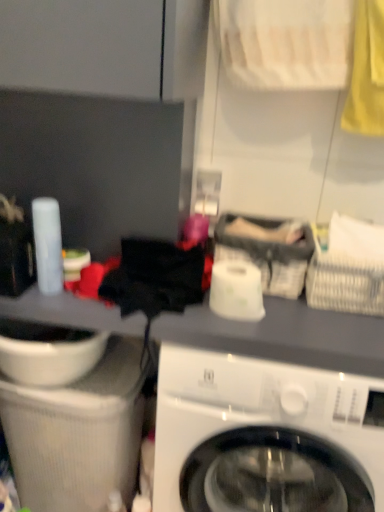
Describe the element at coordinates (268, 250) in the screenshot. I see `gray fabric basket at center, which ranks as the 1th basket in left-to-right order` at that location.

I want to click on white woven basket at upper right, the 2th basket from the left, so click(x=344, y=284).

Image resolution: width=384 pixels, height=512 pixels. What do you see at coordinates (344, 284) in the screenshot? I see `white woven basket at upper right, the 2th basket from the left` at bounding box center [344, 284].

I want to click on gray fabric basket at center, the second basket when ordered from right to left, so click(x=268, y=250).

Does point (375, 267) appear closer or farther from the camera than point (282, 239)?

Point (375, 267) is positioned closer to the camera compared to point (282, 239).

Is white woven basket at upper right, which is the first basket in right-to-left order, positioned far away from gray fabric basket at center, the second basket when ordered from right to left?

Actually, white woven basket at upper right, which is the first basket in right-to-left order, and gray fabric basket at center, the second basket when ordered from right to left, are a little close together.

Can you tell me how much white woven basket at upper right, which is the first basket in right-to-left order, and gray fabric basket at center, which ranks as the 1th basket in left-to-right order, differ in facing direction?

There is a 3.66-degree angle between the facing directions of white woven basket at upper right, which is the first basket in right-to-left order, and gray fabric basket at center, which ranks as the 1th basket in left-to-right order.

From a real-world perspective, does white woven basket at upper right, the 2th basket from the left, sit lower than gray fabric basket at center, which ranks as the 1th basket in left-to-right order?

Incorrect, from a real-world perspective, white woven basket at upper right, the 2th basket from the left, is higher than gray fabric basket at center, which ranks as the 1th basket in left-to-right order.

From a real-world perspective, is gray fabric basket at center, which ranks as the 1th basket in left-to-right order, physically above white glossy toilet paper at center?

Yes, from a real-world perspective, gray fabric basket at center, which ranks as the 1th basket in left-to-right order, is on top of white glossy toilet paper at center.

Considering the relative sizes of gray fabric basket at center, which ranks as the 1th basket in left-to-right order, and white glossy toilet paper at center in the image provided, is gray fabric basket at center, which ranks as the 1th basket in left-to-right order, wider than white glossy toilet paper at center?

Yes, gray fabric basket at center, which ranks as the 1th basket in left-to-right order, is wider than white glossy toilet paper at center.

Would you say gray fabric basket at center, which ranks as the 1th basket in left-to-right order, is inside or outside white glossy toilet paper at center?

gray fabric basket at center, which ranks as the 1th basket in left-to-right order, is located beyond the bounds of white glossy toilet paper at center.

Considering the sizes of objects white glossy toilet paper at center and gray fabric basket at center, the second basket when ordered from right to left, in the image provided, who is smaller, white glossy toilet paper at center or gray fabric basket at center, the second basket when ordered from right to left,?

With smaller size is white glossy toilet paper at center.

Is point (238, 267) closer to camera compared to point (226, 255)?

Yes, point (238, 267) is in front of point (226, 255).

How different are the orientations of white glossy toilet paper at center and gray fabric basket at center, the second basket when ordered from right to left, in degrees?

They differ by 0.0005 degrees in their facing directions.

This screenshot has height=512, width=384. I want to click on sink below the gray fabric basket at center, the second basket when ordered from right to left (from a real-world perspective), so click(x=78, y=433).

From the image's perspective, would you say white glossy sink at lower left is shown under gray fabric basket at center, which ranks as the 1th basket in left-to-right order?

Yes.

Between white glossy sink at lower left and gray fabric basket at center, the second basket when ordered from right to left, which one has smaller width?

gray fabric basket at center, the second basket when ordered from right to left, is thinner.

Do you think white glossy washing machine at center is within white glossy sink at lower left, or outside of it?

white glossy washing machine at center is not inside white glossy sink at lower left, it's outside.

Is point (343, 396) closer or farther from the camera than point (85, 481)?

Point (343, 396) is closer to the camera than point (85, 481).

Is white glossy washing machine at center taller or shorter than white glossy sink at lower left?

Considering their sizes, white glossy washing machine at center has more height than white glossy sink at lower left.

From the image's perspective, is white glossy washing machine at center positioned above or below white glossy toilet paper at center?

white glossy washing machine at center is situated lower than white glossy toilet paper at center in the image.

Image resolution: width=384 pixels, height=512 pixels. What are the coordinates of `washing machine on the right of white glossy toilet paper at center` in the screenshot? It's located at (265, 436).

Is white glossy washing machine at center not close to white glossy toilet paper at center?

They are positioned close to each other.

Between point (383, 490) and point (245, 319), which one is positioned in front?

Point (245, 319)

Considering the positions of objects white woven basket at upper right, which is the first basket in right-to-left order, and white glossy washing machine at center in the image provided, who is more to the left, white woven basket at upper right, which is the first basket in right-to-left order, or white glossy washing machine at center?

From the viewer's perspective, white glossy washing machine at center appears more on the left side.

Considering the relative sizes of white woven basket at upper right, the 2th basket from the left, and white glossy washing machine at center in the image provided, is white woven basket at upper right, the 2th basket from the left, wider than white glossy washing machine at center?

In fact, white woven basket at upper right, the 2th basket from the left, might be narrower than white glossy washing machine at center.

From the image's perspective, is white woven basket at upper right, which is the first basket in right-to-left order, located above or below white glossy washing machine at center?

Based on their image positions, white woven basket at upper right, which is the first basket in right-to-left order, is located above white glossy washing machine at center.

Between white woven basket at upper right, which is the first basket in right-to-left order, and white glossy washing machine at center, which one has less height?

white woven basket at upper right, which is the first basket in right-to-left order.

You are a GUI agent. You are given a task and a screenshot of the screen. Output one action in this format:
    pyautogui.click(x=<x>, y=<y>)
    Task: Click on the basket lying on the left of white woven basket at upper right, which is the first basket in right-to-left order
    This screenshot has width=384, height=512.
    Given the screenshot: What is the action you would take?
    pyautogui.click(x=268, y=250)

The width and height of the screenshot is (384, 512). I want to click on toilet paper located in front of the gray fabric basket at center, the second basket when ordered from right to left, so click(236, 290).

From the image, which object appears to be farther from white glossy toilet paper at center, white woven basket at upper right, the 2th basket from the left, or white glossy washing machine at center?

white glossy washing machine at center lies further to white glossy toilet paper at center than the other object.

Considering their positions, is white glossy sink at lower left positioned closer to white glossy washing machine at center than white woven basket at upper right, the 2th basket from the left?

white glossy sink at lower left is positioned closer to the anchor white glossy washing machine at center.

Which object lies nearer to the anchor point gray fabric basket at center, which ranks as the 1th basket in left-to-right order, white glossy sink at lower left or white glossy washing machine at center?

Among the two, white glossy washing machine at center is located nearer to gray fabric basket at center, which ranks as the 1th basket in left-to-right order.

Considering their positions, is white glossy toilet paper at center positioned closer to white glossy washing machine at center than white woven basket at upper right, which is the first basket in right-to-left order?

Based on the image, white glossy toilet paper at center appears to be nearer to white glossy washing machine at center.

Considering their positions, is white glossy sink at lower left positioned closer to gray fabric basket at center, the second basket when ordered from right to left, than white woven basket at upper right, which is the first basket in right-to-left order?

The object closer to gray fabric basket at center, the second basket when ordered from right to left, is white woven basket at upper right, which is the first basket in right-to-left order.

Based on their spatial positions, is white glossy washing machine at center or white glossy toilet paper at center further from white woven basket at upper right, which is the first basket in right-to-left order?

white glossy washing machine at center is positioned further to the anchor white woven basket at upper right, which is the first basket in right-to-left order.

When comparing their distances from white woven basket at upper right, which is the first basket in right-to-left order, does white glossy washing machine at center or white glossy sink at lower left seem closer?

white glossy washing machine at center is positioned closer to the anchor white woven basket at upper right, which is the first basket in right-to-left order.

From the image, which object appears to be nearer to white glossy toilet paper at center, white woven basket at upper right, which is the first basket in right-to-left order, or white glossy sink at lower left?

white woven basket at upper right, which is the first basket in right-to-left order, is closer to white glossy toilet paper at center.

Find the location of a particular element. This screenshot has height=512, width=384. basket that lies between gray fabric basket at center, which ranks as the 1th basket in left-to-right order, and white glossy washing machine at center from top to bottom is located at coordinates (344, 284).

Find the location of `basket between white glossy sink at lower left and white woven basket at upper right, the 2th basket from the left`. basket between white glossy sink at lower left and white woven basket at upper right, the 2th basket from the left is located at coordinates (268, 250).

This screenshot has width=384, height=512. What are the coordinates of `washing machine located between white glossy sink at lower left and white woven basket at upper right, which is the first basket in right-to-left order, in the left-right direction` in the screenshot? It's located at (265, 436).

Image resolution: width=384 pixels, height=512 pixels. Find the location of `toilet paper between gray fabric basket at center, which ranks as the 1th basket in left-to-right order, and white glossy washing machine at center from top to bottom`. toilet paper between gray fabric basket at center, which ranks as the 1th basket in left-to-right order, and white glossy washing machine at center from top to bottom is located at coordinates (236, 290).